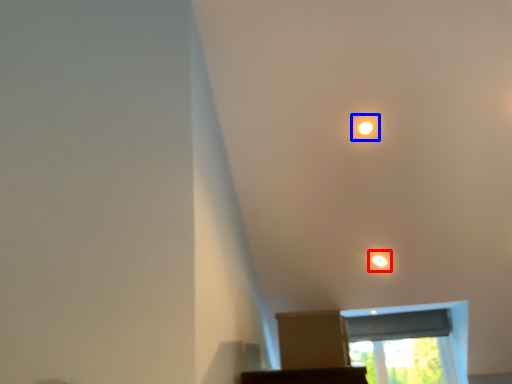
Question: Which point is closer to the camera, light (highlighted by a red box) or dot (highlighted by a blue box)?

Choices:
 (A) light
 (B) dot

Answer: (B)